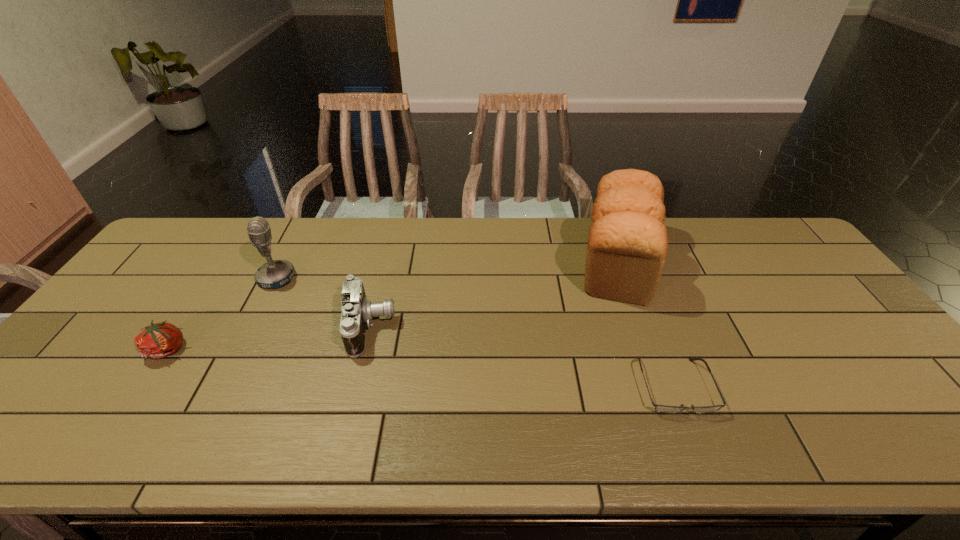
Image resolution: width=960 pixels, height=540 pixels. I want to click on blank region between the second shortest object and the fourth object from right to left, so click(223, 314).

Locate an element on the screen. The image size is (960, 540). free space between the third tallest object and the microphone is located at coordinates (324, 303).

Find the location of `free spot between the third tallest object and the second tallest object`. free spot between the third tallest object and the second tallest object is located at coordinates (324, 303).

This screenshot has width=960, height=540. I want to click on vacant area between the third object from right to left and the spectacles, so click(522, 356).

Identify the location of vacant area that lies between the spectacles and the fourth object from right to left. (475, 332).

This screenshot has width=960, height=540. What are the coordinates of `free space between the spectacles and the third object from right to left` in the screenshot? It's located at (522, 356).

Find the location of `empty space between the tallest object and the spectacles`. empty space between the tallest object and the spectacles is located at coordinates (646, 323).

In order to click on free spot between the tallest object and the second object from left to right in this screenshot , I will do (447, 269).

I want to click on free point between the second object from left to right and the bread, so click(x=447, y=269).

Find the location of `empty location between the microphone and the fourth tallest object`. empty location between the microphone and the fourth tallest object is located at coordinates (223, 314).